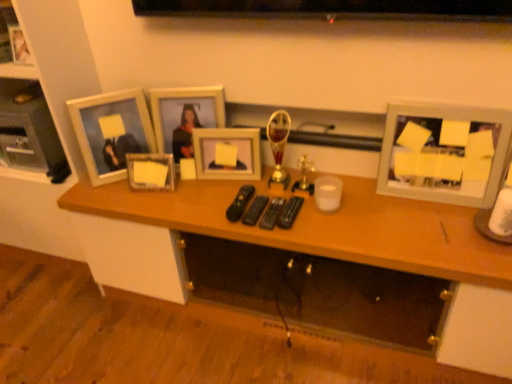
In order to click on vacant space to the left of wooden picture frame at center, the 4th picture frame in the right-to-left sequence in this screenshot , I will do `click(111, 194)`.